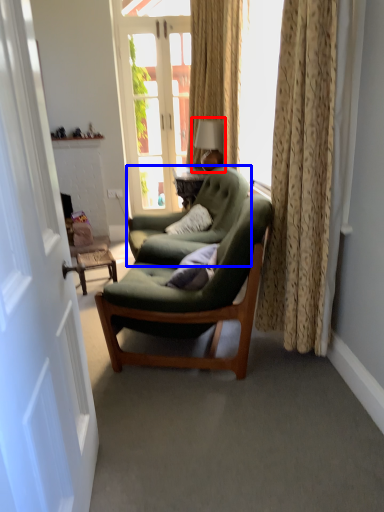
Question: Which object is closer to the camera taking this photo, table lamp (highlighted by a red box) or chair (highlighted by a blue box)?

Choices:
 (A) table lamp
 (B) chair

Answer: (B)